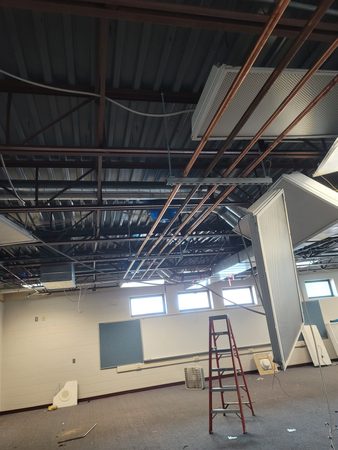
Identify the location of rafters. (156, 68).